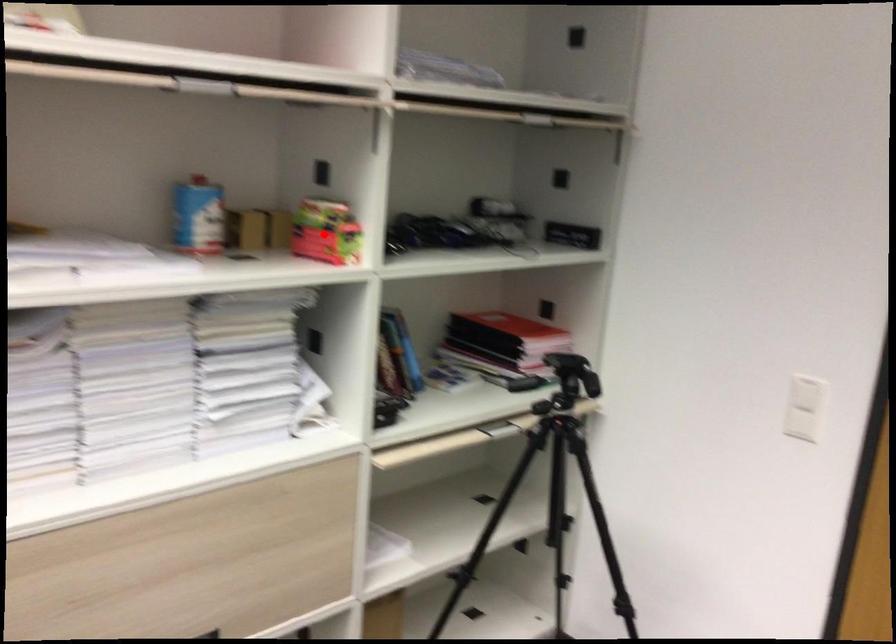
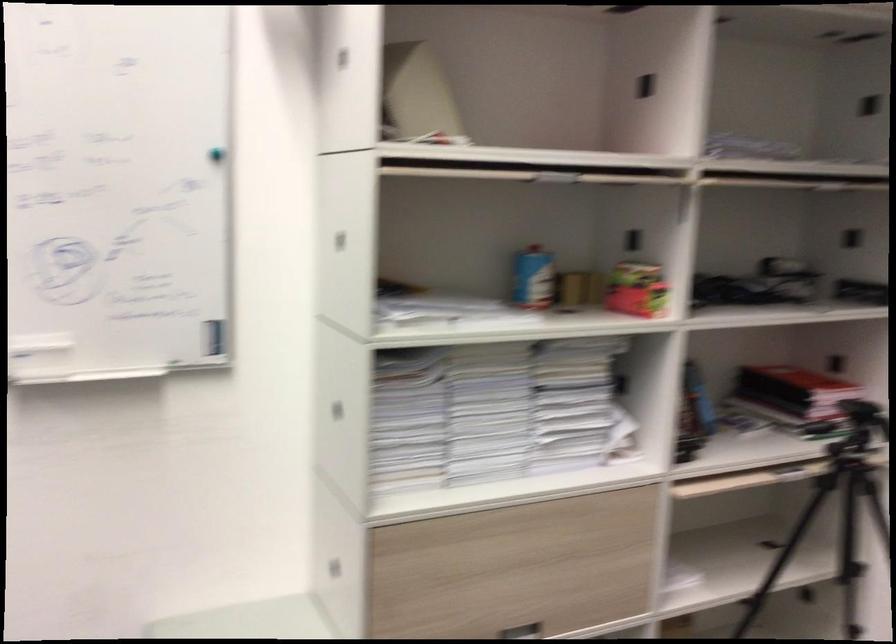
The point at the highlighted location is marked in the first image. Where is the corresponding point in the second image?

(636, 289)